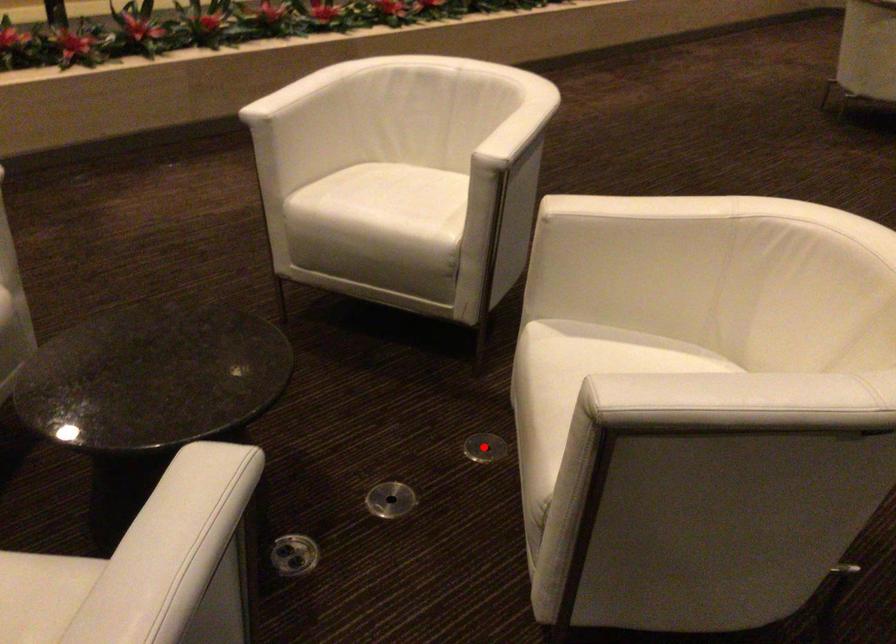
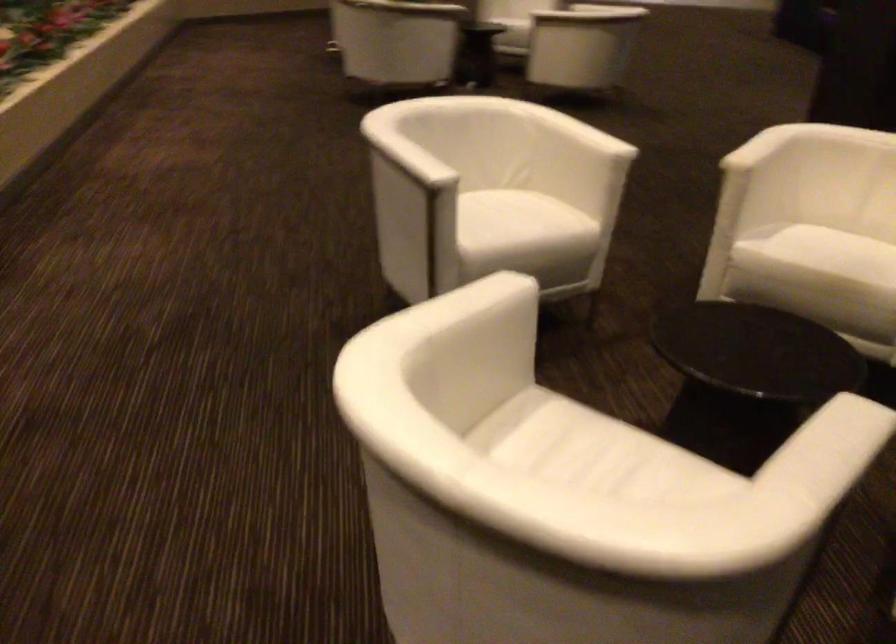
Question: I am providing you with two images of the same scene from different viewpoints. A red point is marked on the first image. At the location where the point appears in image 1, is it still visible in image 2?

Choices:
 (A) Yes
 (B) No

Answer: (B)